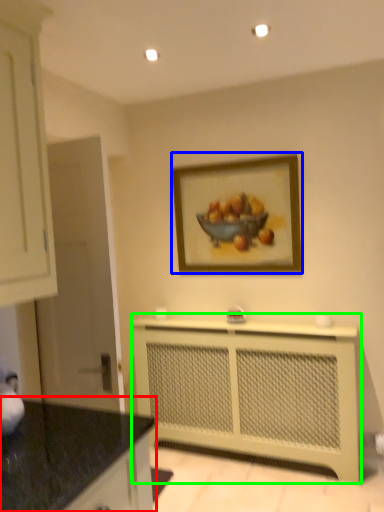
Question: Estimate the real-world distances between objects in this image. Which object is farther from countertop (highlighted by a red box), picture frame (highlighted by a blue box) or counter (highlighted by a green box)?

Choices:
 (A) picture frame
 (B) counter

Answer: (A)